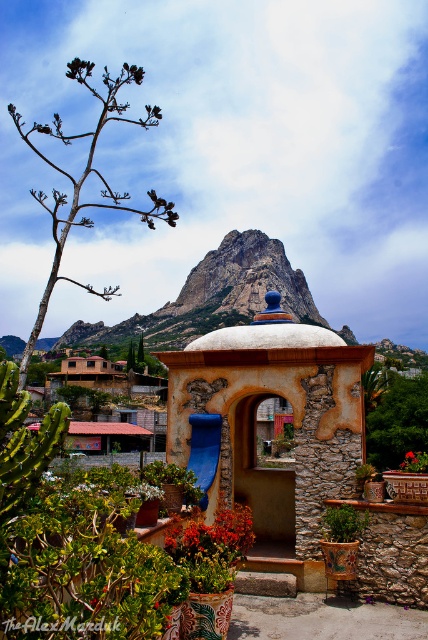
Question: Estimate the real-world distances between objects in this image. Which object is farther from the brown woody tree at left?

Choices:
 (A) rustic stone mountain at upper center
 (B) green leafy tree at center

Answer: (B)

Question: Among these objects, which one is nearest to the camera?

Choices:
 (A) green leafy tree at center
 (B) brown woody tree at left
 (C) terracotta stone gazebo at center

Answer: (C)

Question: Can you confirm if rustic stone mountain at upper center is thinner than brown wooden hut at center?

Choices:
 (A) no
 (B) yes

Answer: (A)

Question: Does terracotta stone gazebo at center have a lesser width compared to brown woody tree at left?

Choices:
 (A) no
 (B) yes

Answer: (B)

Question: Does terracotta stone gazebo at center have a larger size compared to brown woody tree at left?

Choices:
 (A) yes
 (B) no

Answer: (B)

Question: Which point appears closest to the camera in this image?

Choices:
 (A) (279, 280)
 (B) (174, 225)

Answer: (B)